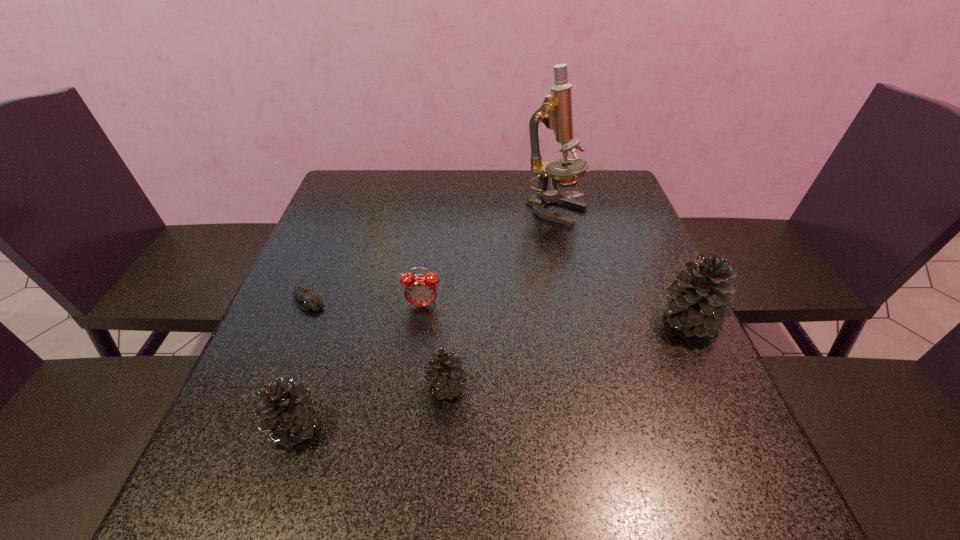
Locate an element on the screen. The image size is (960, 540). free space located 0.190m on the left of the farthest pinecone is located at coordinates (570, 321).

The height and width of the screenshot is (540, 960). What are the coordinates of `free location located on the back of the fifth object from left to right` in the screenshot? It's located at (551, 189).

You are a GUI agent. You are given a task and a screenshot of the screen. Output one action in this format:
    pyautogui.click(x=<x>, y=<y>)
    Task: Click on the vacant space located 0.290m on the back of the computer mouse
    This screenshot has width=960, height=540.
    Given the screenshot: What is the action you would take?
    point(343,217)

This screenshot has width=960, height=540. In order to click on free region located on the face of the alarm clock in this screenshot , I will do `click(413, 375)`.

This screenshot has height=540, width=960. Identify the location of object that is positioned at the far edge. (556, 113).

At what (x,y) coordinates should I click in order to perform the action: click on pinecone that is at the left edge. Please return your answer as a coordinate pair (x, y). This screenshot has width=960, height=540. Looking at the image, I should click on (291, 412).

Find the location of a particular element. The height and width of the screenshot is (540, 960). computer mouse that is at the left edge is located at coordinates (307, 298).

Locate an element on the screen. The image size is (960, 540). pinecone that is at the right edge is located at coordinates (697, 302).

Find the location of a particular element. microscope that is positioned at the right edge is located at coordinates (556, 113).

Locate an element on the screen. This screenshot has height=540, width=960. object at the near left corner is located at coordinates (291, 412).